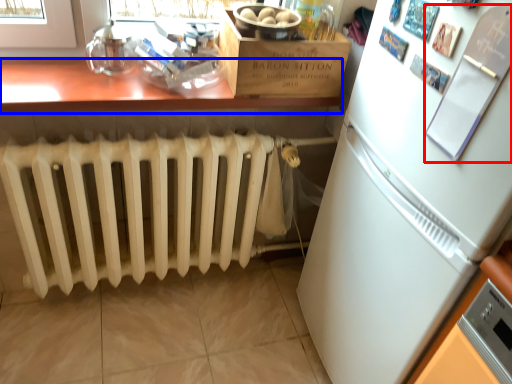
Question: Among these objects, which one is farthest to the camera, bulletin board (highlighted by a red box) or table (highlighted by a blue box)?

Choices:
 (A) bulletin board
 (B) table

Answer: (B)